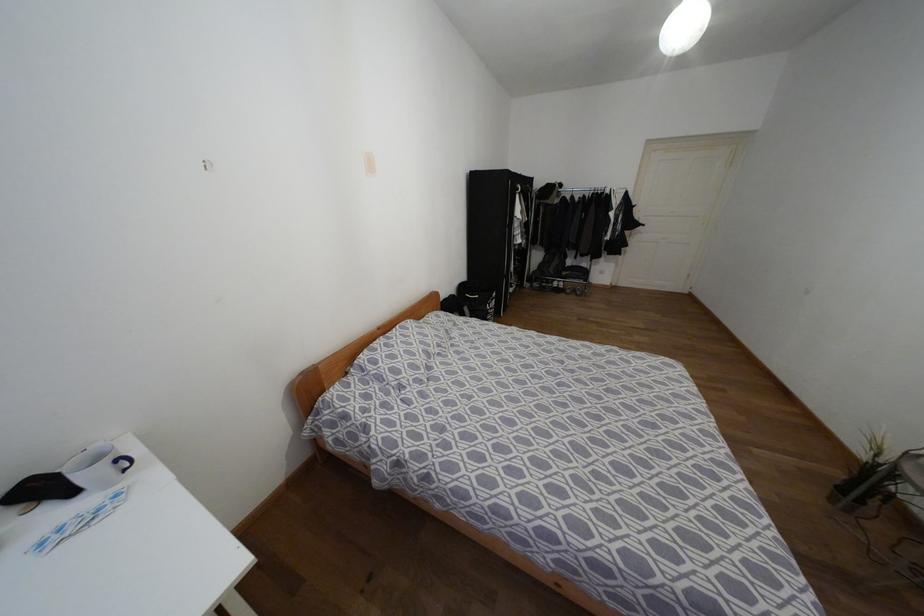
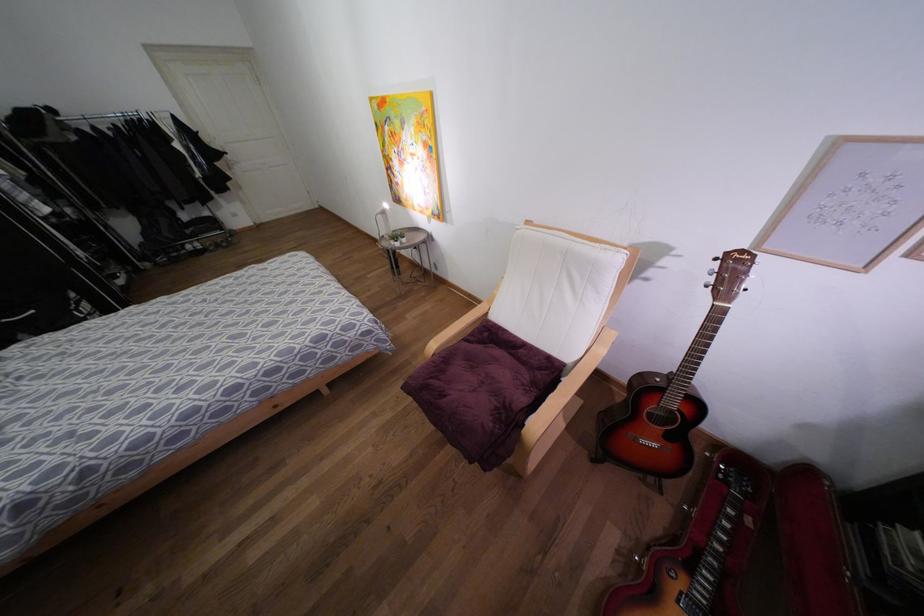
The images are taken continuously from a first-person perspective. In which direction is your viewpoint rotating?

The camera rotated toward right-down.